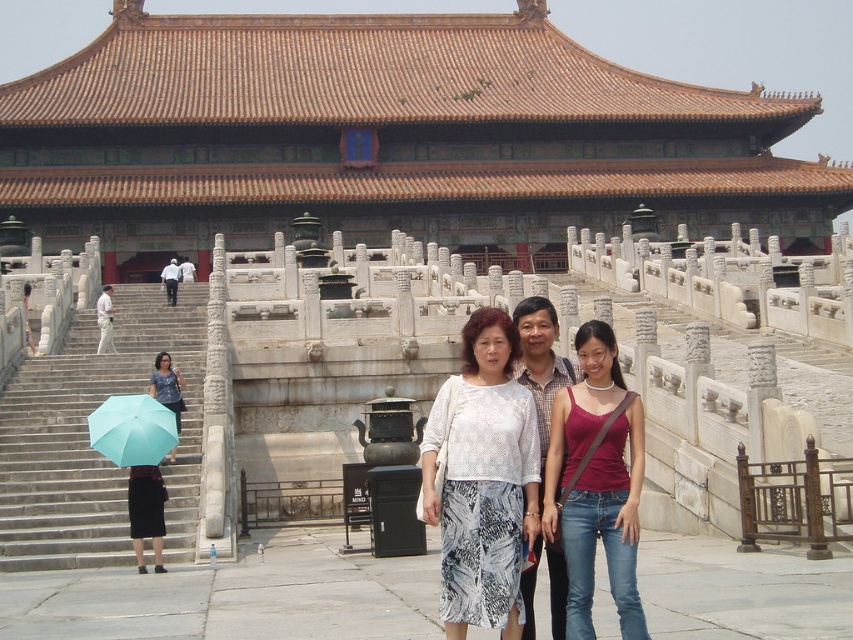
Question: Among these points, which one is nearest to the camera?

Choices:
 (A) (20, 140)
 (B) (171, 392)

Answer: (B)

Question: Can you confirm if white lace blouse at center is wider than matte red tank top at center?

Choices:
 (A) no
 (B) yes

Answer: (B)

Question: Where is brown glazed tile roof at center located in relation to matte red tank top at center in the image?

Choices:
 (A) above
 (B) below

Answer: (A)

Question: Which object is farther from the camera taking this photo?

Choices:
 (A) white lace blouse at center
 (B) matte red tank top at center
 (C) brown glazed tile roof at center

Answer: (C)

Question: Which object is farther from the camera taking this photo?

Choices:
 (A) matte blue umbrella at lower left
 (B) light blue fabric umbrella at left
 (C) white lace blouse at center
 (D) light blue fabric umbrella at lower left

Answer: (A)

Question: Does brown glazed tile roof at center have a greater width compared to matte blue umbrella at lower left?

Choices:
 (A) no
 (B) yes

Answer: (B)